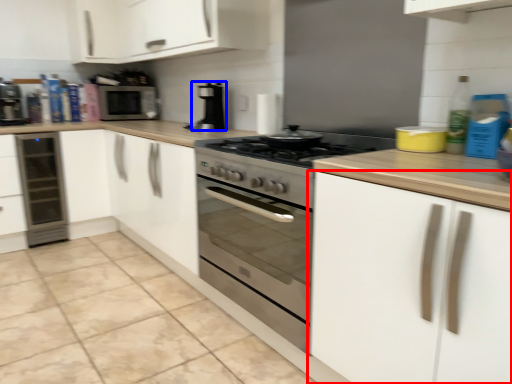
Question: Among these objects, which one is farthest to the camera, cabinetry (highlighted by a red box) or kitchen appliance (highlighted by a blue box)?

Choices:
 (A) cabinetry
 (B) kitchen appliance

Answer: (B)